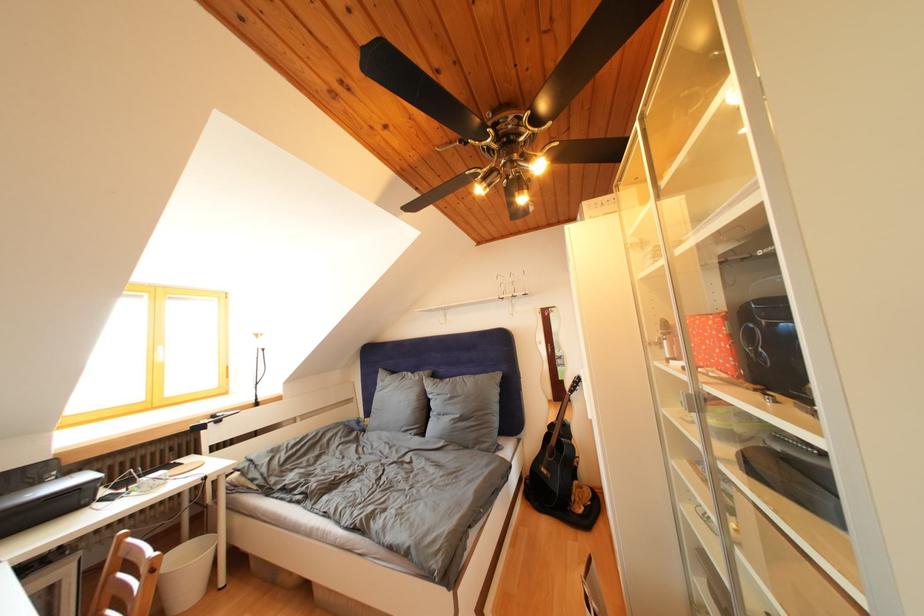
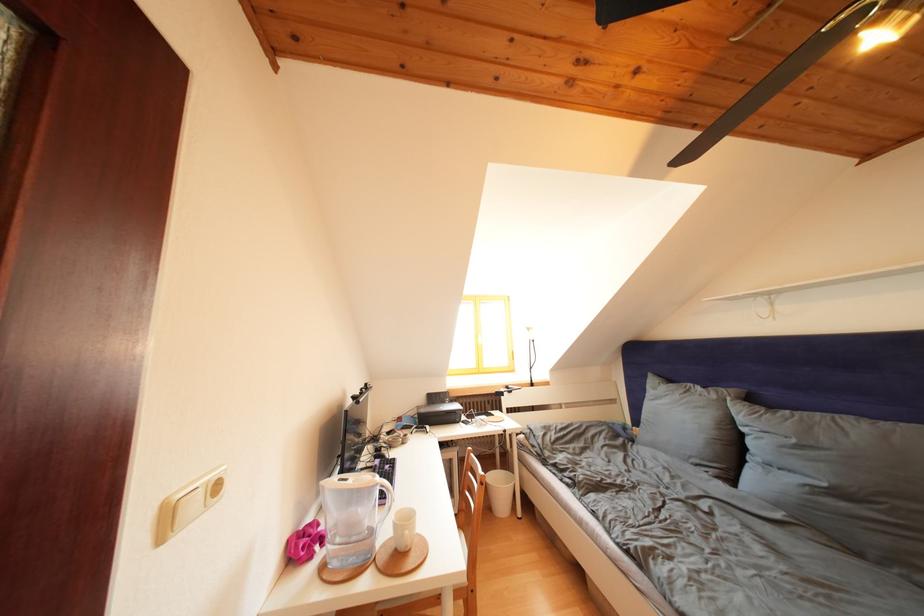
Where in the second image is the point corresponding to (x=426, y=383) from the first image?

(722, 402)